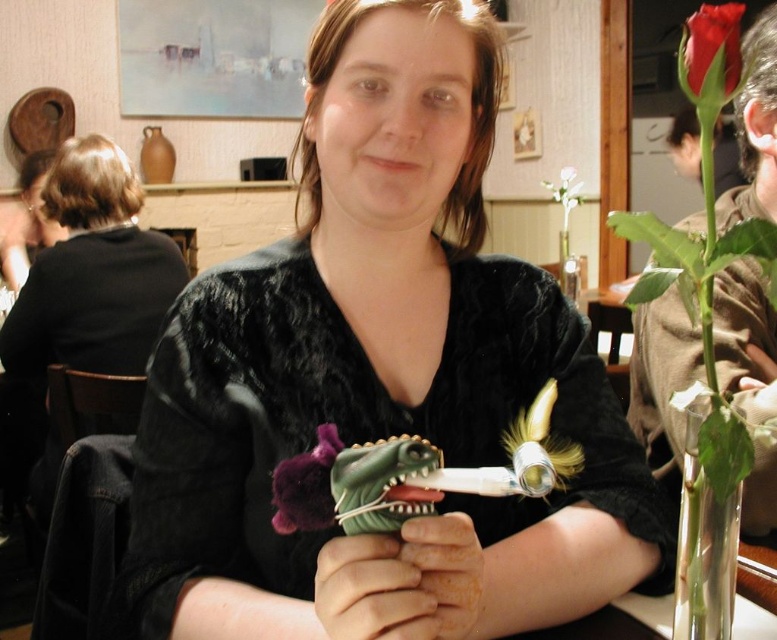
Does point (336, 193) lie behind point (704, 76)?

Yes.

From the picture: Is velvet black shirt at center taller than matte red rose at upper right?

Correct, velvet black shirt at center is much taller as matte red rose at upper right.

Who is more forward, (497, 573) or (737, 26)?

Point (737, 26) is more forward.

Locate an element on the screen. velvet black shirt at center is located at coordinates (382, 364).

Who is taller, green matte toy at center or matte red rose at upper right?

With more height is matte red rose at upper right.

Is the position of green matte toy at center less distant than that of matte red rose at upper right?

No, green matte toy at center is behind matte red rose at upper right.

Where is `green matte toy at center`? The image size is (777, 640). green matte toy at center is located at coordinates (375, 588).

You are a GUI agent. You are given a task and a screenshot of the screen. Output one action in this format:
    pyautogui.click(x=<x>, y=<y>)
    Task: Click on the velvet purple flower at center
    This screenshot has width=777, height=640.
    Given the screenshot: What is the action you would take?
    pyautogui.click(x=305, y=484)

How much distance is there between velvet purple flower at center and matte red rose at upper right?

They are 14.56 inches apart.

Is point (319, 486) closer to camera compared to point (702, 26)?

That is True.

Find the location of a particular element. velvet purple flower at center is located at coordinates (305, 484).